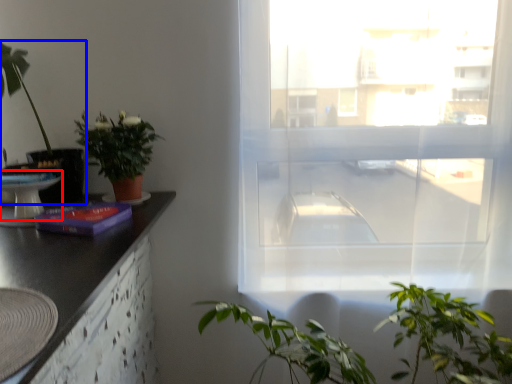
Question: Among these objects, which one is farthest to the camera, round table (highlighted by a red box) or houseplant (highlighted by a blue box)?

Choices:
 (A) round table
 (B) houseplant

Answer: (B)